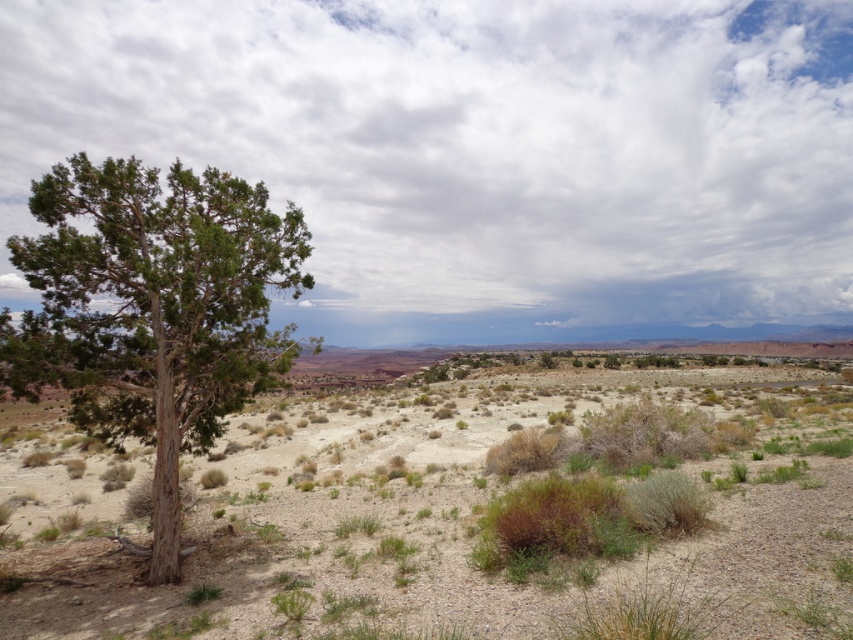
Is point (704, 376) more distant than point (305, 285)?

Yes.

Between point (572, 436) and point (103, 161), which one is positioned in front?

Point (572, 436) is in front.

Is point (595, 579) farther from camera compared to point (308, 280)?

No.

Find the location of `green shrubbery at center`. green shrubbery at center is located at coordinates (454, 509).